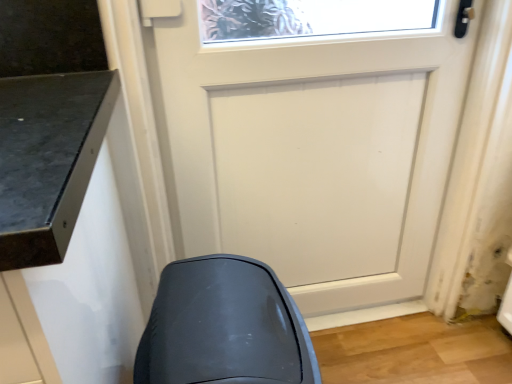
Question: Could you tell me if white matte door at center is turned towards matte gray swivel chair at lower left?

Choices:
 (A) yes
 (B) no

Answer: (A)

Question: From the image's perspective, is white matte door at center located above matte gray swivel chair at lower left?

Choices:
 (A) yes
 (B) no

Answer: (A)

Question: Considering the relative sizes of white matte door at center and matte gray swivel chair at lower left in the image provided, is white matte door at center wider than matte gray swivel chair at lower left?

Choices:
 (A) yes
 (B) no

Answer: (B)

Question: Does white matte door at center appear on the left side of matte gray swivel chair at lower left?

Choices:
 (A) yes
 (B) no

Answer: (B)

Question: Is white matte door at center positioned behind matte gray swivel chair at lower left?

Choices:
 (A) no
 (B) yes

Answer: (B)

Question: Is white matte door at center taller than matte gray swivel chair at lower left?

Choices:
 (A) yes
 (B) no

Answer: (A)

Question: From the image's perspective, is matte gray swivel chair at lower left located beneath white matte door at center?

Choices:
 (A) no
 (B) yes

Answer: (B)

Question: Considering the relative sizes of matte gray swivel chair at lower left and white matte door at center in the image provided, is matte gray swivel chair at lower left taller than white matte door at center?

Choices:
 (A) yes
 (B) no

Answer: (B)

Question: From the image's perspective, is matte gray swivel chair at lower left on top of white matte door at center?

Choices:
 (A) no
 (B) yes

Answer: (A)

Question: From a real-world perspective, does matte gray swivel chair at lower left sit lower than white matte door at center?

Choices:
 (A) no
 (B) yes

Answer: (B)

Question: From a real-world perspective, is matte gray swivel chair at lower left located higher than white matte door at center?

Choices:
 (A) yes
 (B) no

Answer: (B)

Question: Considering the relative sizes of matte gray swivel chair at lower left and white matte door at center in the image provided, is matte gray swivel chair at lower left smaller than white matte door at center?

Choices:
 (A) no
 (B) yes

Answer: (B)

Question: In terms of height, does matte gray swivel chair at lower left look taller or shorter compared to white matte door at center?

Choices:
 (A) short
 (B) tall

Answer: (A)